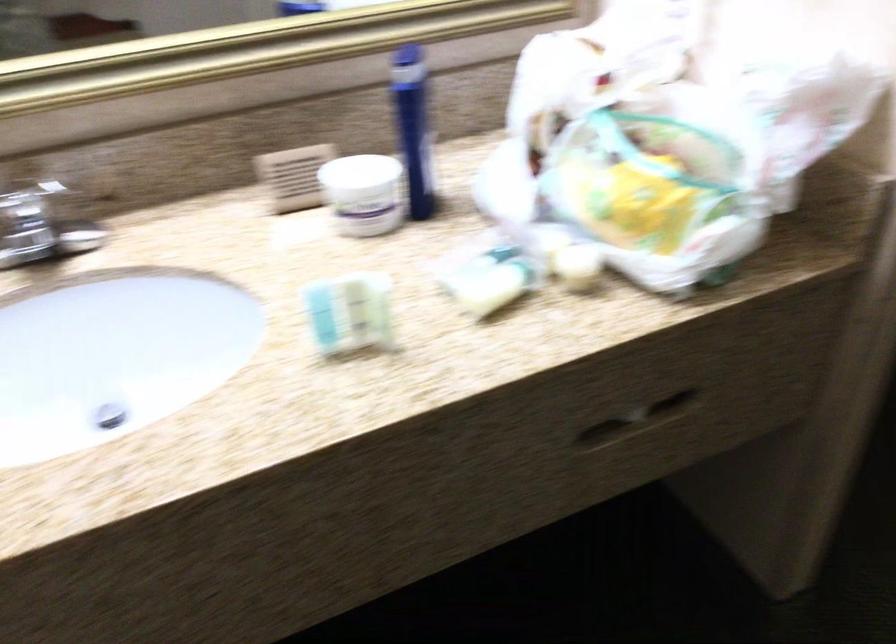
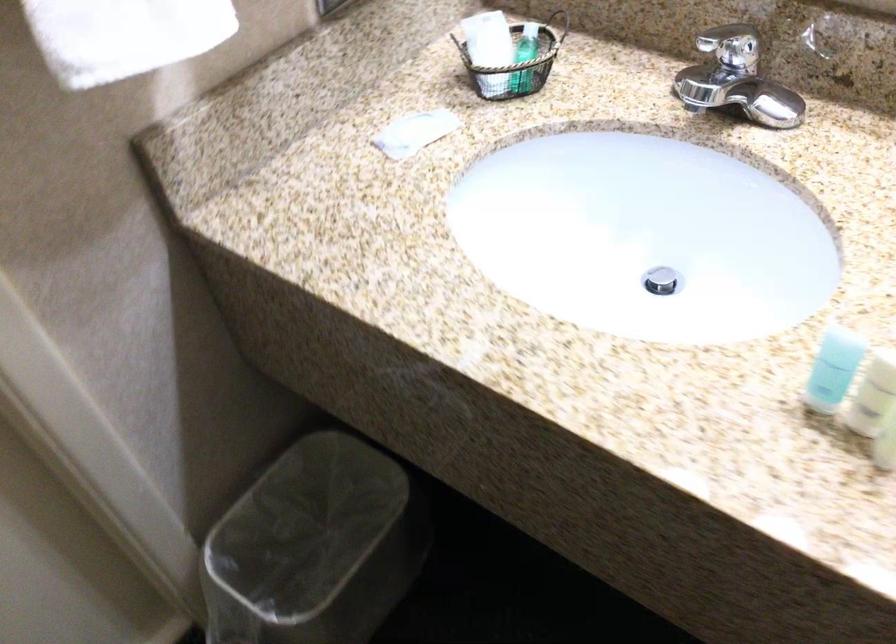
The point at (x=347, y=310) is marked in the first image. Where is the corresponding point in the second image?

(873, 395)